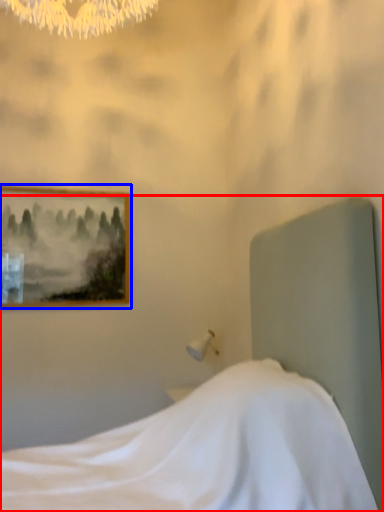
Question: Among these objects, which one is farthest to the camera, bed (highlighted by a red box) or picture frame (highlighted by a blue box)?

Choices:
 (A) bed
 (B) picture frame

Answer: (B)